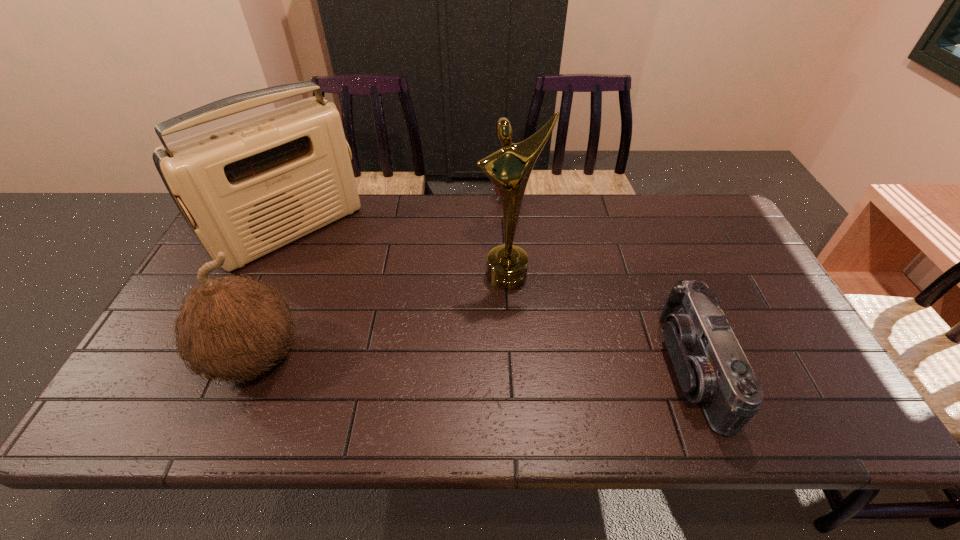
Identify the location of free area in between the coconut and the award. (381, 316).

At what (x,y) coordinates should I click in order to perform the action: click on vacant region between the shortest object and the third shortest object. Please return your answer as a coordinate pair (x, y). Image resolution: width=960 pixels, height=540 pixels. Looking at the image, I should click on (381, 279).

Find the location of a particular element. free spot between the camcorder and the coconut is located at coordinates (473, 363).

The width and height of the screenshot is (960, 540). I want to click on vacant area between the shortest object and the camcorder, so click(600, 284).

Locate an element on the screen. free space between the camcorder and the award is located at coordinates [600, 322].

Identify which object is the closest to the radio receiver. Please provide its 2D coordinates. Your answer should be formatted as a tuple, i.e. [(x, y)], where the tuple contains the x and y coordinates of a point satisfying the conditions above.

[(232, 327)]

Identify which object is the third closest to the camcorder. Please provide its 2D coordinates. Your answer should be formatted as a tuple, i.e. [(x, y)], where the tuple contains the x and y coordinates of a point satisfying the conditions above.

[(248, 188)]

Where is `free region that satisfies the following two spatial constraints: 1. on the back side of the radio receiver; 2. on the left side of the shortest object`? free region that satisfies the following two spatial constraints: 1. on the back side of the radio receiver; 2. on the left side of the shortest object is located at coordinates (306, 200).

This screenshot has height=540, width=960. Identify the location of vacant space that satisfies the following two spatial constraints: 1. on the surface of the camcorder; 2. on the front-facing side of the third tallest object. (250, 369).

Locate an element on the screen. The image size is (960, 540). free space that satisfies the following two spatial constraints: 1. on the surface of the coconut; 2. on the front-facing side of the camcorder is located at coordinates (x=250, y=369).